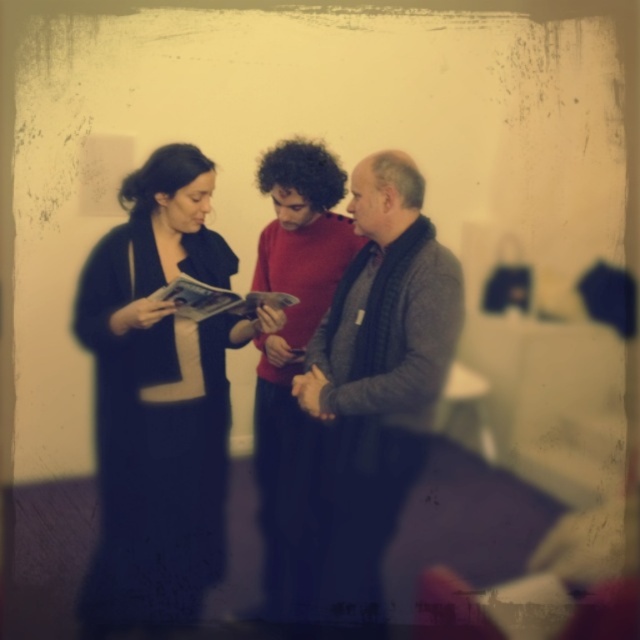
Who is positioned more to the left, gray sweater at center or red sweater at center?

red sweater at center

What are the coordinates of `gray sweater at center` in the screenshot? It's located at (378, 376).

Does dark blue dress at center have a lesser width compared to red sweater at center?

No, dark blue dress at center is not thinner than red sweater at center.

Can you confirm if dark blue dress at center is shorter than red sweater at center?

No.

Does point (205, 433) lie behind point (272, 168)?

Yes.

The height and width of the screenshot is (640, 640). I want to click on dark blue dress at center, so click(x=157, y=397).

Describe the element at coordinates (157, 397) in the screenshot. I see `dark blue dress at center` at that location.

Which of these two, dark blue dress at center or gray sweater at center, stands shorter?

gray sweater at center

Image resolution: width=640 pixels, height=640 pixels. Find the location of `dark blue dress at center`. dark blue dress at center is located at coordinates (157, 397).

Locate an element on the screen. This screenshot has height=640, width=640. dark blue dress at center is located at coordinates (157, 397).